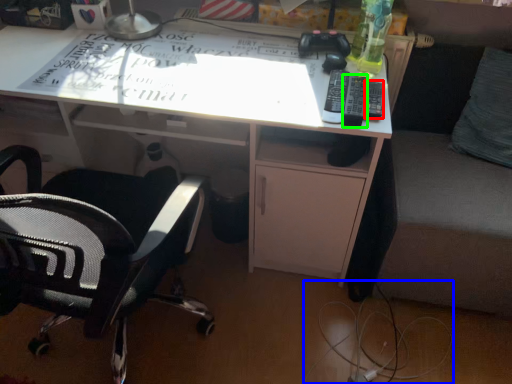
Question: Based on their relative distances, which object is farther from remote (highlighted by a red box)? Choose from wire (highlighted by a blue box) and remote (highlighted by a green box).

Choices:
 (A) wire
 (B) remote

Answer: (A)